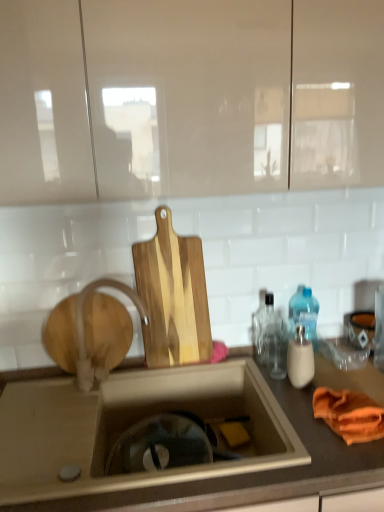
This screenshot has width=384, height=512. In order to click on vacant area that is in front of orange cloth at right in this screenshot , I will do `click(340, 461)`.